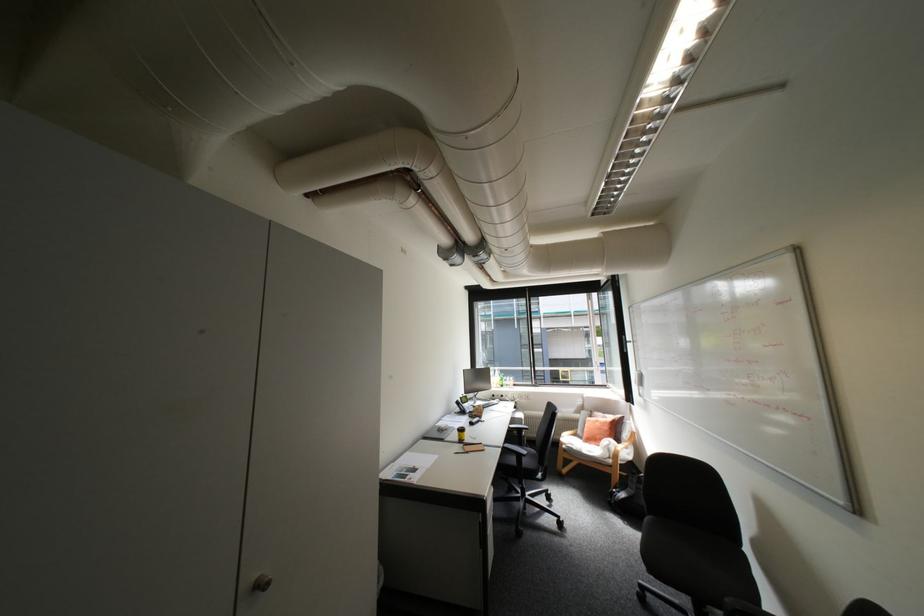
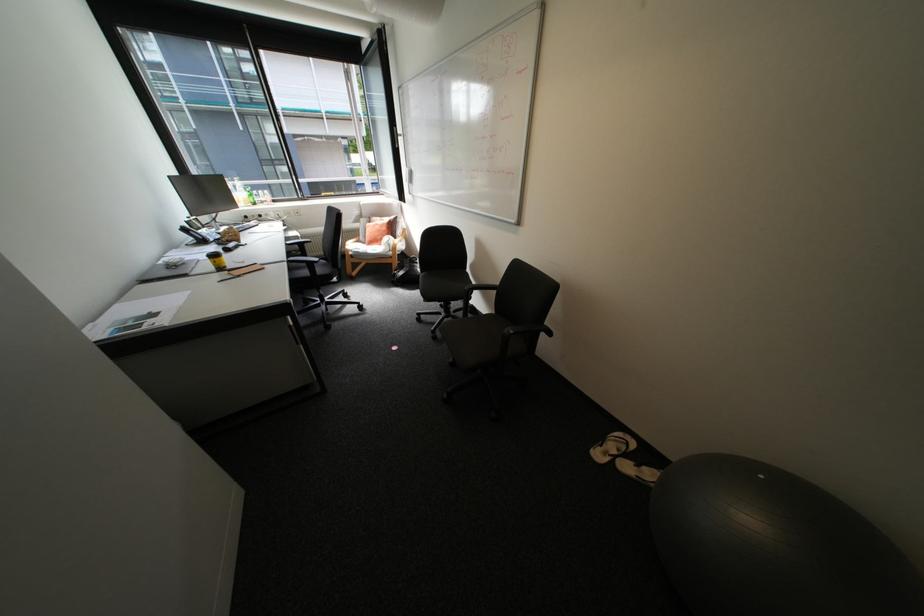
The point at (465, 436) is marked in the first image. Where is the corresponding point in the second image?

(217, 265)